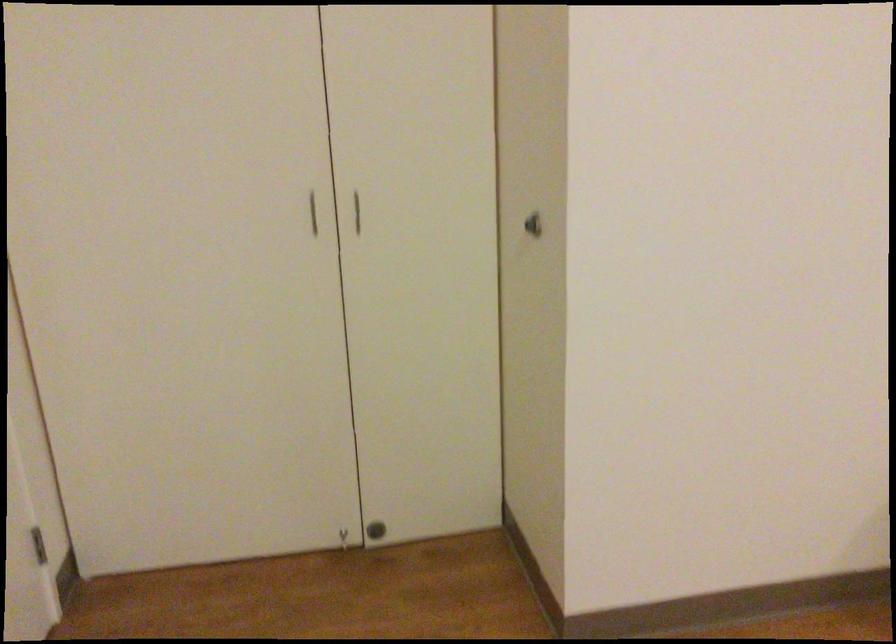
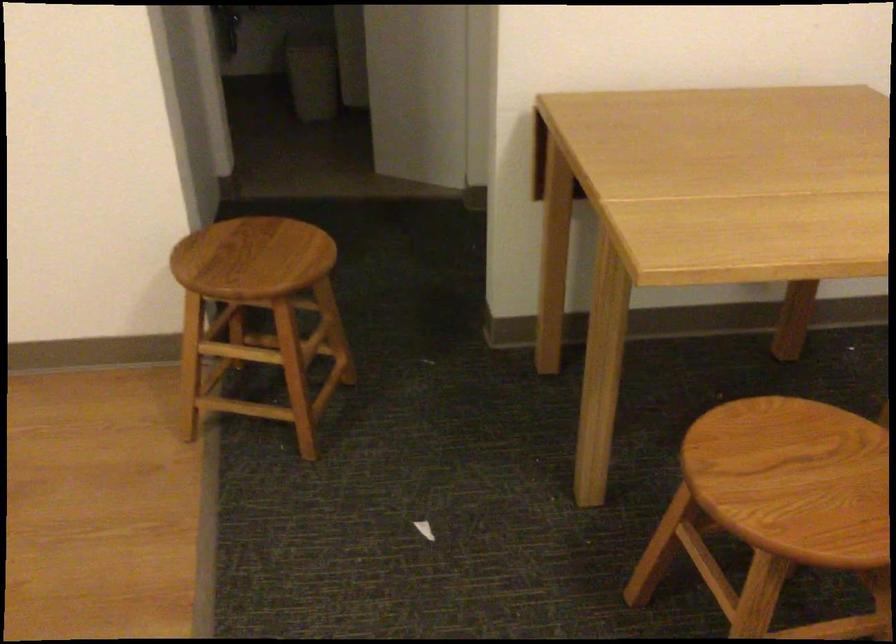
Question: In a continuous first-person perspective shot, in which direction is the camera moving?

Choices:
 (A) Left
 (B) Right
 (C) Forward
 (D) Backward

Answer: (B)